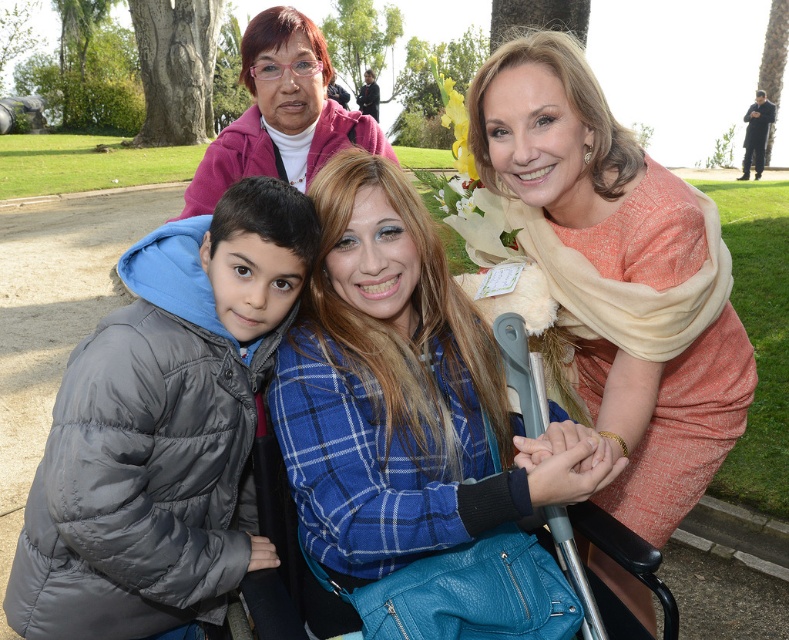
Question: Does blue plaid shirt at center have a smaller size compared to matte pink sweater at upper left?

Choices:
 (A) no
 (B) yes

Answer: (B)

Question: From the image, what is the correct spatial relationship of matte orange dress at center in relation to matte pink sweater at upper left?

Choices:
 (A) right
 (B) left

Answer: (A)

Question: Is gray puffy jacket at center closer to the viewer compared to matte orange dress at center?

Choices:
 (A) no
 (B) yes

Answer: (B)

Question: Which point is closer to the camera?

Choices:
 (A) blue plaid shirt at center
 (B) matte pink sweater at upper left
 (C) matte orange dress at center
 (D) gray puffy jacket at center

Answer: (A)

Question: Which object appears closest to the camera in this image?

Choices:
 (A) gray puffy jacket at center
 (B) blue plaid shirt at center
 (C) matte orange dress at center
 (D) matte pink sweater at upper left

Answer: (B)

Question: Estimate the real-world distances between objects in this image. Which object is farther from the matte orange dress at center?

Choices:
 (A) gray puffy jacket at center
 (B) blue plaid shirt at center

Answer: (A)